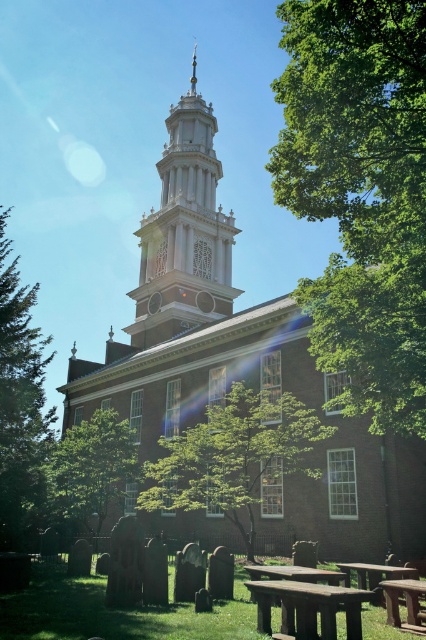
You are planning to set up a temporary stage for a small event. The stage requires a space of 9 meters between the green grass at lower center and the wooden picnic table at lower right. Is the available space sufficient?

The distance between the green grass at lower center and the wooden picnic table at lower right is 8.93 meters, which is slightly less than the required 9 meters. Therefore, the available space is insufficient for the stage setup.

You are standing in front of a historic brick building with a tower. You notice a point marked at coordinates [184,232]. What architectural feature is located at that point?

The point at coordinates [184,232] is where the brick stonework bell tower at center is located.